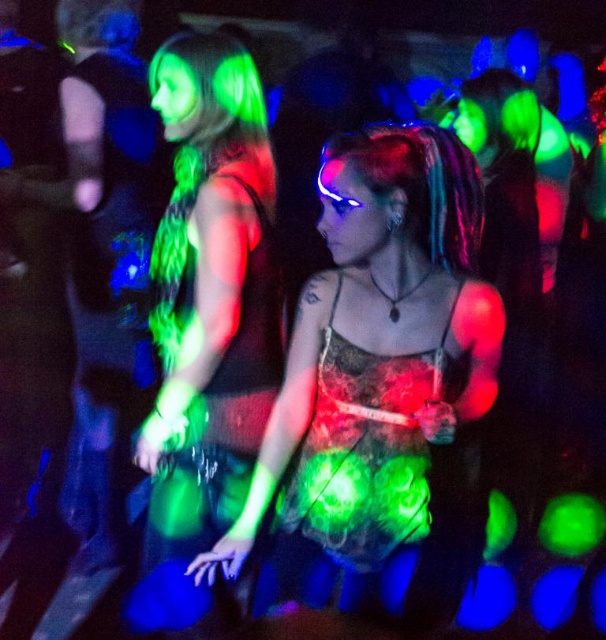
Question: Is translucent lace top at center to the left of green fluorescent dress at left from the viewer's perspective?

Choices:
 (A) no
 (B) yes

Answer: (A)

Question: Does translucent lace top at center appear over green fluorescent dress at left?

Choices:
 (A) no
 (B) yes

Answer: (B)

Question: Can you confirm if translucent lace top at center is positioned above green fluorescent dress at left?

Choices:
 (A) no
 (B) yes

Answer: (B)